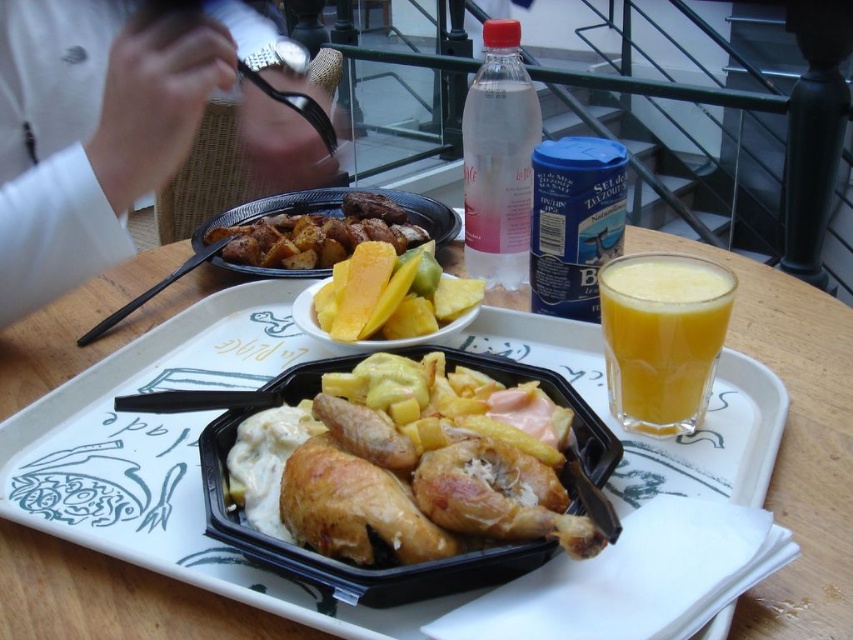
You are a delivery person standing 10 inches away from a table. You need to place a package on the black plastic tray at center. Can you reach it without moving closer?

The black plastic tray at center is 9.48 inches away from the viewer, so yes, the delivery person can reach it without moving closer since they are only 10 inches away.

You are a waiter who needs to place a 30 cm long spoon on the table without it touching any of the translucent glass cup at upper right or yellow matte pineapple at center. Is this possible?

The translucent glass cup at upper right is 27.11 centimeters away from the yellow matte pineapple at center. Since the spoon is 30 cm long, placing it between them would require at least 27.11 cm of space, but the spoon is longer than that distance. Therefore, the spoon might extend beyond the space between them, potentially touching either object. However, if placed diagonally or at an angle, it might fit without touching either. Alternatively, placing it elsewhere on the table where there is more space,